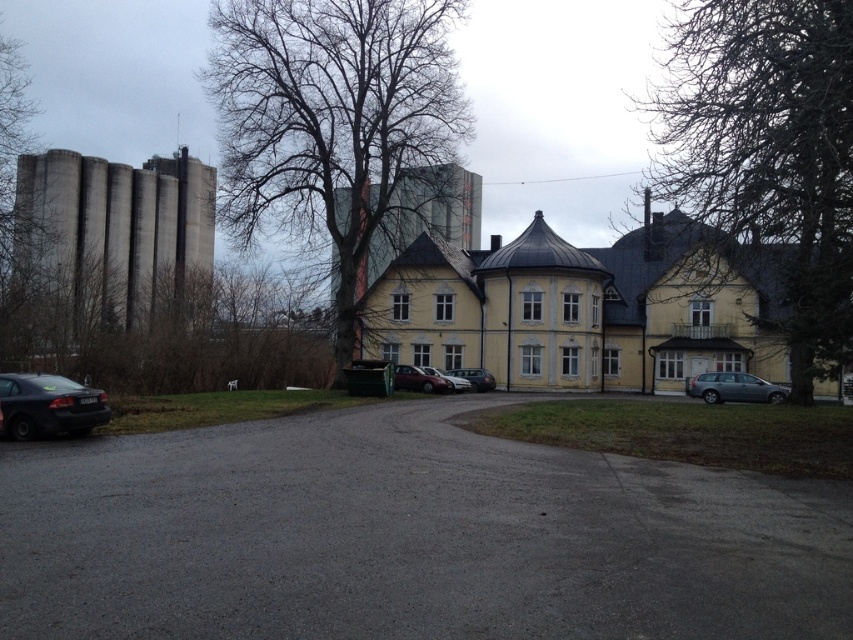
You are standing in front of the large yellow building and want to take a photo of the bare branches at upper center and the bare branches at left. Which set of branches will appear larger in your photo?

The bare branches at upper center will appear larger in the photo because they are closer to the viewer than the bare branches at left.